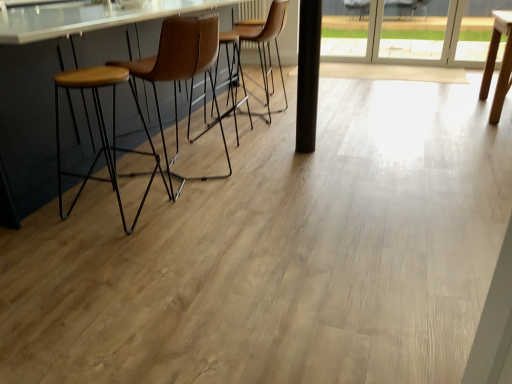
Where is `free point below brown leather stool at left, the second chair viewed from the back (from a real-world perspective)`? The width and height of the screenshot is (512, 384). free point below brown leather stool at left, the second chair viewed from the back (from a real-world perspective) is located at coordinates (193, 170).